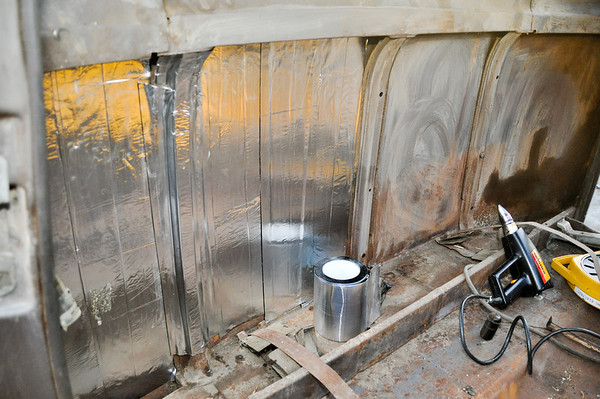
At what (x,y) coordinates should I click in order to perform the action: click on fan. Please return your answer as a coordinate pair (x, y). The width and height of the screenshot is (600, 399). Looking at the image, I should click on (576, 275).